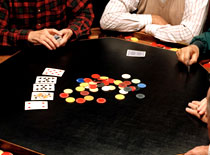
This screenshot has height=155, width=210. Identify the location of blue back of card on the table. (136, 54).